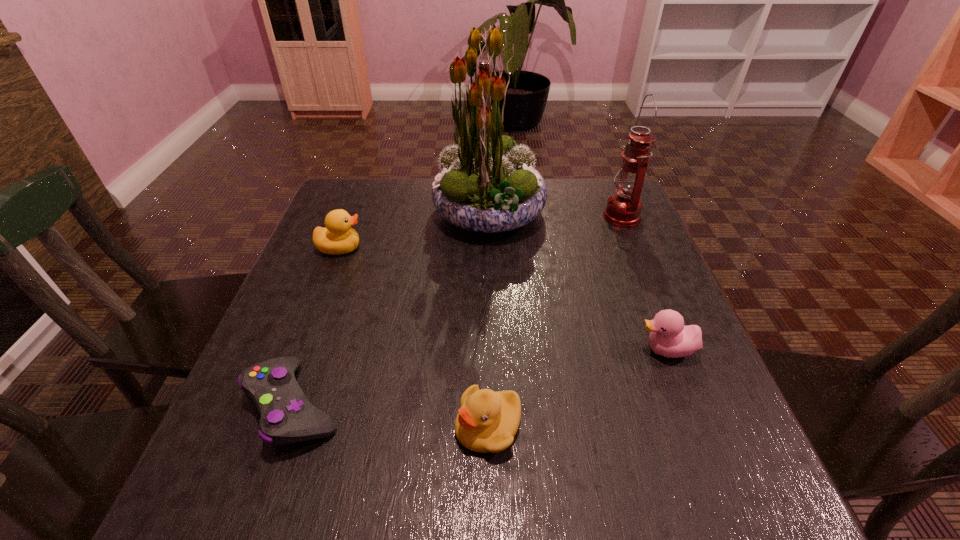
Locate an element on the screen. This screenshot has width=960, height=540. empty location between the rightmost duckling and the second tallest object is located at coordinates (644, 283).

You are a GUI agent. You are given a task and a screenshot of the screen. Output one action in this format:
    pyautogui.click(x=<x>, y=<y>)
    Task: Click on the empty space between the rightmost duckling and the oil lamp
    Image resolution: width=960 pixels, height=540 pixels.
    Given the screenshot: What is the action you would take?
    pyautogui.click(x=644, y=283)

Locate which object is the third closest to the flower arrangement. Please provide its 2D coordinates. Your answer should be formatted as a tuple, i.e. [(x, y)], where the tuple contains the x and y coordinates of a point satisfying the conditions above.

[(669, 337)]

Locate an element on the screen. Image resolution: width=960 pixels, height=540 pixels. object identified as the second closest to the second tallest object is located at coordinates (669, 337).

Identify which duckling is the second closest to the control. Please provide its 2D coordinates. Your answer should be formatted as a tuple, i.e. [(x, y)], where the tuple contains the x and y coordinates of a point satisfying the conditions above.

[(338, 237)]

Locate which duckling ranks in proximity to the fifth shortest object. Please provide its 2D coordinates. Your answer should be formatted as a tuple, i.e. [(x, y)], where the tuple contains the x and y coordinates of a point satisfying the conditions above.

[(669, 337)]

Locate an element on the screen. Image resolution: width=960 pixels, height=540 pixels. vacant region that satisfies the following two spatial constraints: 1. on the front-facing side of the flower arrangement; 2. on the front side of the control is located at coordinates (494, 405).

The height and width of the screenshot is (540, 960). I want to click on vacant region that satisfies the following two spatial constraints: 1. on the front side of the fifth shortest object; 2. on the front-facing side of the second duckling from left to right, so click(709, 426).

At what (x,y) coordinates should I click in order to perform the action: click on vacant position in the image that satisfies the following two spatial constraints: 1. on the front-facing side of the rightmost duckling; 2. on the front side of the shortest object. Please return your answer as a coordinate pair (x, y). This screenshot has height=540, width=960. Looking at the image, I should click on (688, 405).

The image size is (960, 540). Find the location of `free location that satisfies the following two spatial constraints: 1. on the front-facing side of the flower arrangement; 2. on the back side of the oil lamp`. free location that satisfies the following two spatial constraints: 1. on the front-facing side of the flower arrangement; 2. on the back side of the oil lamp is located at coordinates (489, 216).